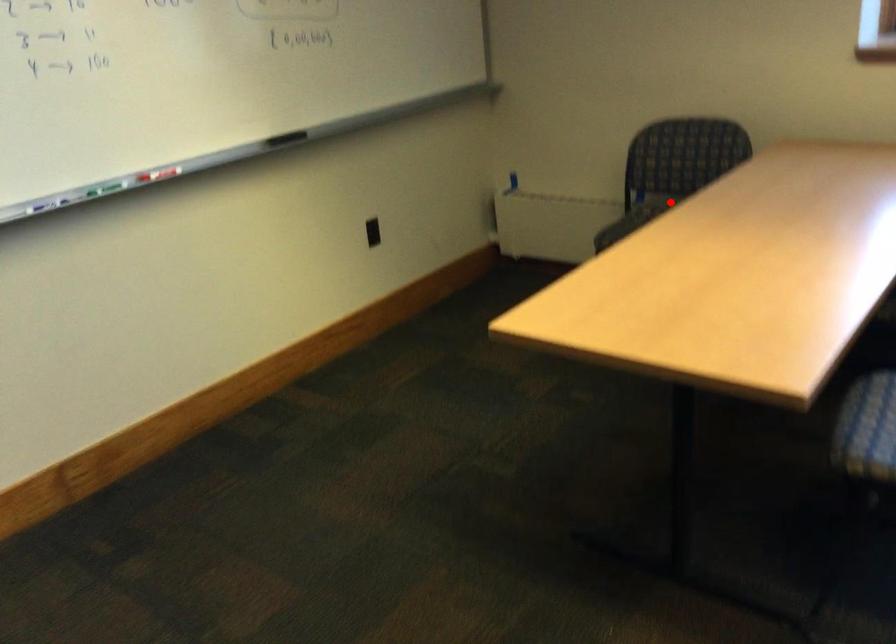
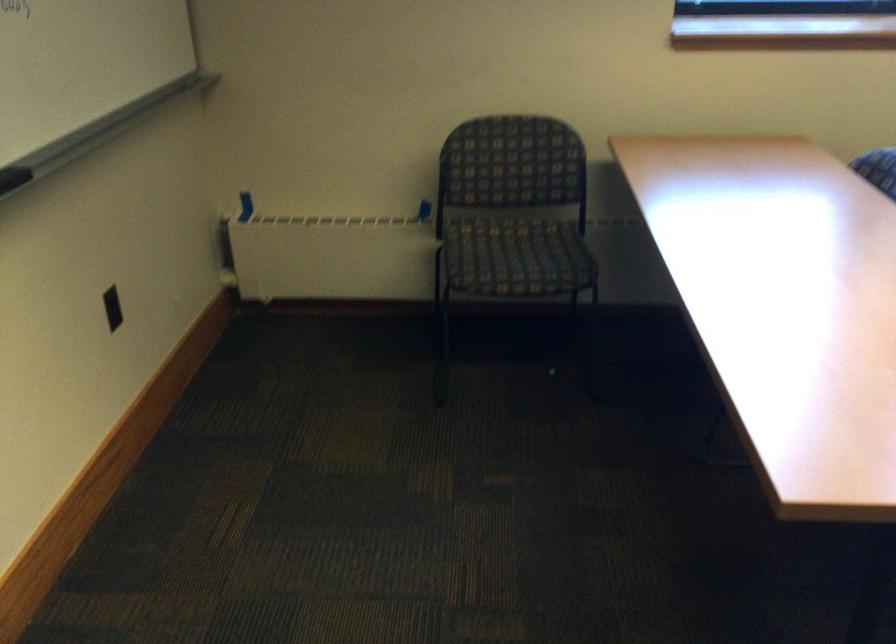
Question: A red point is marked in image1. In image2, is the corresponding 3D point closer to the camera or farther? Reply with the corresponding letter.

Choices:
 (A) The corresponding 3D point is closer.
 (B) The corresponding 3D point is farther.

Answer: (A)